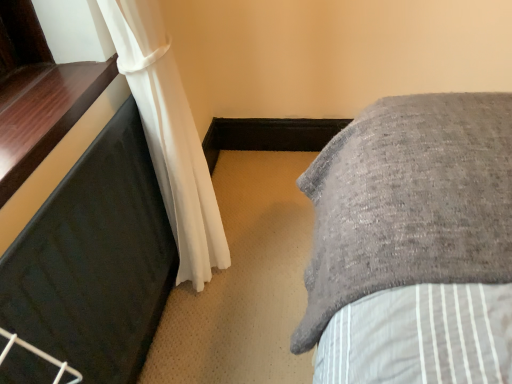
Where is `empty space that is in between white sheer curtain at left and black rubber mat at left`? empty space that is in between white sheer curtain at left and black rubber mat at left is located at coordinates (185, 345).